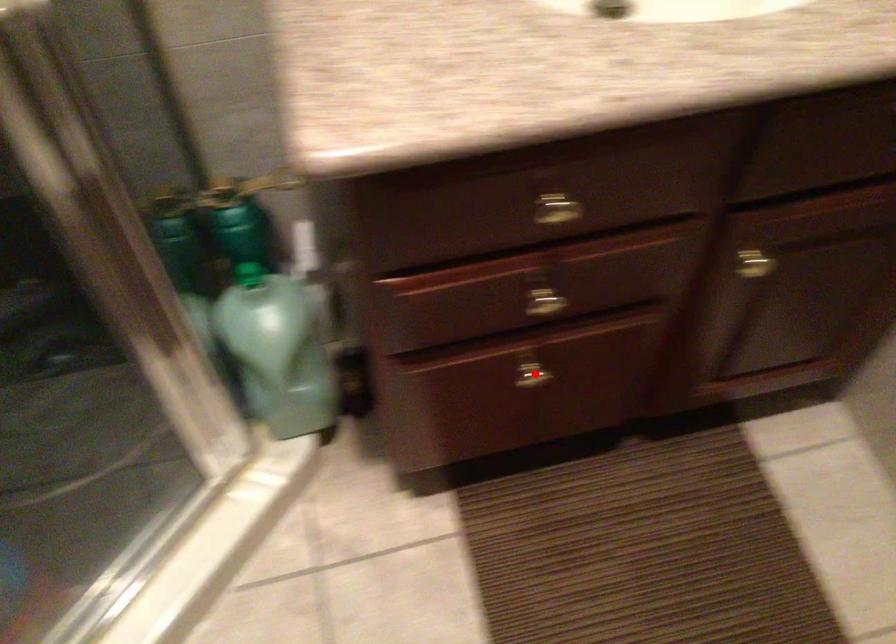
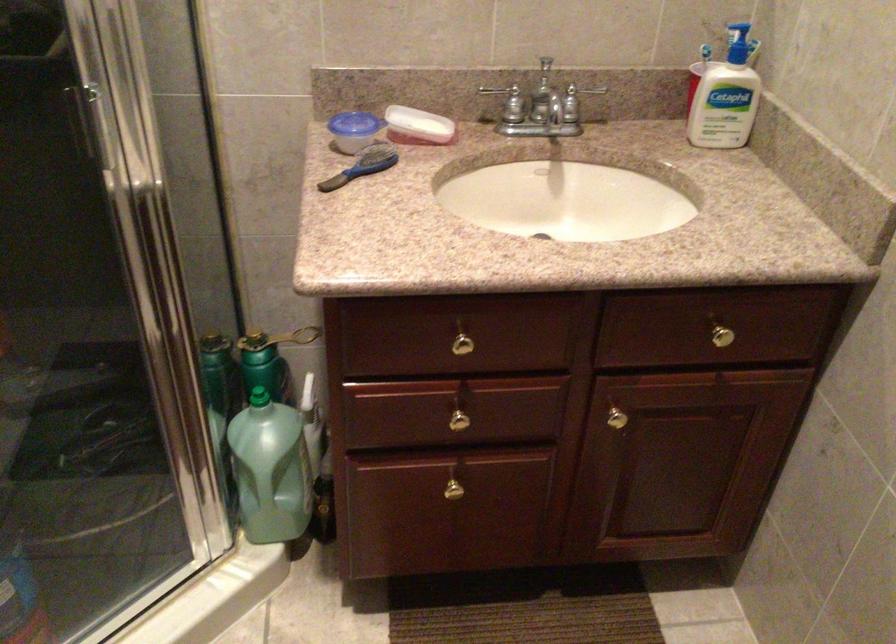
Question: A red point is marked in image1. In image2, is the corresponding 3D point closer to the camera or farther? Reply with the corresponding letter.

Choices:
 (A) The corresponding 3D point is closer.
 (B) The corresponding 3D point is farther.

Answer: (B)